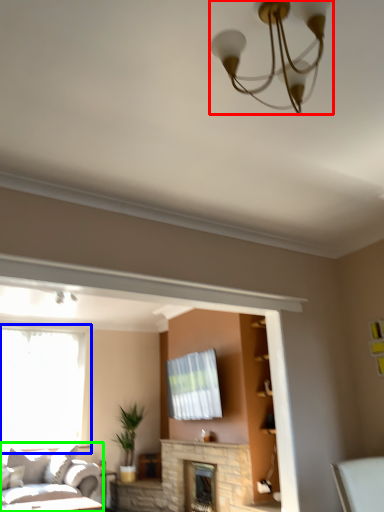
Question: Estimate the real-world distances between objects in this image. Which object is closer to lamp (highlighted by a red box), window (highlighted by a blue box) or studio couch (highlighted by a green box)?

Choices:
 (A) window
 (B) studio couch

Answer: (A)